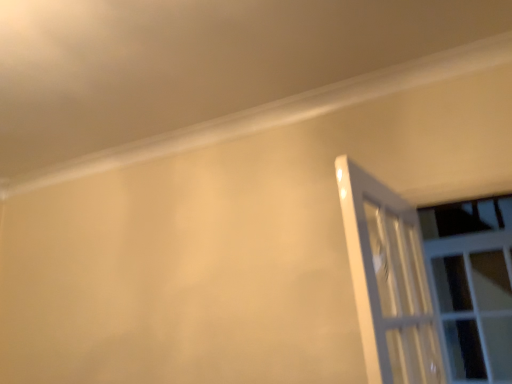
Where is `white glass window at upper right`? Image resolution: width=512 pixels, height=384 pixels. white glass window at upper right is located at coordinates (428, 284).

The image size is (512, 384). What do you see at coordinates (428, 284) in the screenshot? I see `white glass window at upper right` at bounding box center [428, 284].

Locate an element on the screen. white glass window at upper right is located at coordinates (428, 284).